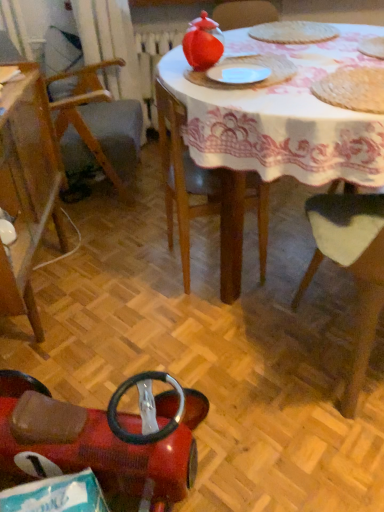
Find the location of a particular element. white lace tablecloth at upper center is located at coordinates click(x=277, y=130).

You are a GUI agent. You are given a task and a screenshot of the screen. Output one action in this format:
    pyautogui.click(x=<x>, y=<y>)
    Task: Click on the rubberized red toy car at lower left, the 2th chair positioned from the right
    The image size is (384, 512).
    Given the screenshot: What is the action you would take?
    pyautogui.click(x=104, y=437)

Image resolution: width=384 pixels, height=512 pixels. What are the coordinates of `white textured placemat at upper center, positioned as the 1th food in top-to-bottom order` in the screenshot? It's located at (293, 32).

Measure the distance between matte glass tea pot at upper center and camera.

matte glass tea pot at upper center and camera are 4.33 feet apart from each other.

What is the approximate width of woven mat at upper right, which is the 1th food from front to back?

woven mat at upper right, which is the 1th food from front to back, is 14.72 inches in width.

This screenshot has height=512, width=384. Find the location of `wooden chair at left, the first chair when ordered from left to right`. wooden chair at left, the first chair when ordered from left to right is located at coordinates (27, 189).

This screenshot has width=384, height=512. I want to click on white lace tablecloth at upper center, so click(277, 130).

Considering the relative sizes of white lace tablecloth at upper center and woven mat at upper right, which is the second food in top-to-bottom order, in the image provided, is white lace tablecloth at upper center wider than woven mat at upper right, which is the second food in top-to-bottom order,?

Correct, the width of white lace tablecloth at upper center exceeds that of woven mat at upper right, which is the second food in top-to-bottom order.

Which object is positioned more to the left, white lace tablecloth at upper center or woven mat at upper right, which is the 1th food from front to back?

Positioned to the left is white lace tablecloth at upper center.

Locate an element on the screen. The image size is (384, 512). table in front of the woven mat at upper right, the first food when ordered from bottom to top is located at coordinates (277, 130).

Does white lace tablecloth at upper center turn towards woven mat at upper right, placed as the 2th food when sorted from back to front?

No, white lace tablecloth at upper center is not oriented towards woven mat at upper right, placed as the 2th food when sorted from back to front.

Is white lace tablecloth at upper center completely or partially inside white textured placemat at upper center, which is the 2th food from front to back?

That's incorrect, white lace tablecloth at upper center is not inside white textured placemat at upper center, which is the 2th food from front to back.

From a real-world perspective, does white textured placemat at upper center, which is the 2th food from front to back, sit lower than white lace tablecloth at upper center?

No.

At what (x,y) coordinates should I click in order to perform the action: click on the 2nd food behind the white lace tablecloth at upper center. Please return your answer as a coordinate pair (x, y). Image resolution: width=384 pixels, height=512 pixels. Looking at the image, I should click on click(293, 32).

From a real-world perspective, is white matte paper plate at center located beneath wooden chair at left, acting as the third chair starting from the right?

No, from a real-world perspective, white matte paper plate at center is not below wooden chair at left, acting as the third chair starting from the right.

From the image's perspective, who appears lower, white matte paper plate at center or wooden chair at left, acting as the third chair starting from the right?

wooden chair at left, acting as the third chair starting from the right, appears lower in the image.

Is white matte paper plate at center positioned before wooden chair at left, acting as the third chair starting from the right?

No, the depth of white matte paper plate at center is greater than that of wooden chair at left, acting as the third chair starting from the right.

Choose the correct answer: Is rubberized red toy car at lower left, the 2th chair positioned from the right, inside white textured placemat at upper center, positioned as the 1th food in top-to-bottom order, or outside it?

rubberized red toy car at lower left, the 2th chair positioned from the right, lies outside white textured placemat at upper center, positioned as the 1th food in top-to-bottom order.

Between rubberized red toy car at lower left, the 2th chair positioned from the right, and white textured placemat at upper center, positioned as the 1th food in top-to-bottom order, which one has less height?

white textured placemat at upper center, positioned as the 1th food in top-to-bottom order, is shorter.

From a real-world perspective, between rubberized red toy car at lower left, the second chair viewed from the left, and white textured placemat at upper center, placed as the 2th food when sorted from bottom to top, who is vertically higher?

From a 3D spatial view, white textured placemat at upper center, placed as the 2th food when sorted from bottom to top, is above.

Considering the points (182, 466) and (299, 32), which point is behind, point (182, 466) or point (299, 32)?

Positioned behind is point (299, 32).

Is matte glass tea pot at upper center to the left of white lace tablecloth at upper center from the viewer's perspective?

Correct, you'll find matte glass tea pot at upper center to the left of white lace tablecloth at upper center.

Considering the relative sizes of matte glass tea pot at upper center and white lace tablecloth at upper center in the image provided, is matte glass tea pot at upper center smaller than white lace tablecloth at upper center?

Yes, matte glass tea pot at upper center is smaller than white lace tablecloth at upper center.

Considering their positions, is matte glass tea pot at upper center located in front of or behind white lace tablecloth at upper center?

Visually, matte glass tea pot at upper center is located behind white lace tablecloth at upper center.

Where is `table on the right of matte glass tea pot at upper center`? This screenshot has height=512, width=384. table on the right of matte glass tea pot at upper center is located at coordinates (277, 130).

Locate an element on the screen. chair on the right side of rubberized red toy car at lower left, the second chair viewed from the left is located at coordinates (351, 266).

Does wooden chair at lower right, the 1th chair positioned from the right, have a larger size compared to rubberized red toy car at lower left, the 2th chair positioned from the right?

Yes, wooden chair at lower right, the 1th chair positioned from the right, is bigger than rubberized red toy car at lower left, the 2th chair positioned from the right.

Is wooden chair at lower right, the 1th chair positioned from the right, at the right side of rubberized red toy car at lower left, the second chair viewed from the left?

Yes, wooden chair at lower right, the 1th chair positioned from the right, is to the right of rubberized red toy car at lower left, the second chair viewed from the left.

Would you say wooden chair at lower right, the 1th chair positioned from the right, contains rubberized red toy car at lower left, the 2th chair positioned from the right?

No, wooden chair at lower right, the 1th chair positioned from the right, does not contain rubberized red toy car at lower left, the 2th chair positioned from the right.

Considering the positions of objects white lace tablecloth at upper center and white matte paper plate at center in the image provided, who is behind, white lace tablecloth at upper center or white matte paper plate at center?

white matte paper plate at center is behind.

Is white lace tablecloth at upper center far from white matte paper plate at center?

That's not correct — white lace tablecloth at upper center is a little close to white matte paper plate at center.

In terms of width, does white lace tablecloth at upper center look wider or thinner when compared to white matte paper plate at center?

In the image, white lace tablecloth at upper center appears to be wider than white matte paper plate at center.

Which of these two, white lace tablecloth at upper center or white matte paper plate at center, is bigger?

With larger size is white lace tablecloth at upper center.

The width and height of the screenshot is (384, 512). Identify the location of table beneath the woven mat at upper right, placed as the 2th food when sorted from back to front (from a real-world perspective). (277, 130).

From a real-world perspective, which food is the 2nd one above the white lace tablecloth at upper center? Please provide its 2D coordinates.

[(293, 32)]

Estimate the real-world distances between objects in this image. Which object is further from wooden chair at left, the first chair when ordered from left to right, white matte paper plate at center or wooden chair at lower right, the 1th chair positioned from the right?

The object further to wooden chair at left, the first chair when ordered from left to right, is wooden chair at lower right, the 1th chair positioned from the right.

From the picture: When comparing their distances from rubberized red toy car at lower left, the second chair viewed from the left, does white textured placemat at upper center, the first food when ordered from back to front, or woven mat at upper right, the first food when ordered from bottom to top, seem further?

white textured placemat at upper center, the first food when ordered from back to front, is positioned further to the anchor rubberized red toy car at lower left, the second chair viewed from the left.

When comparing their distances from white textured placemat at upper center, the first food when ordered from back to front, does wooden chair at left, the first chair when ordered from left to right, or rubberized red toy car at lower left, the second chair viewed from the left, seem further?

Among the two, rubberized red toy car at lower left, the second chair viewed from the left, is located further to white textured placemat at upper center, the first food when ordered from back to front.

Considering their positions, is wooden chair at left, the first chair when ordered from left to right, positioned closer to white textured placemat at upper center, placed as the 2th food when sorted from bottom to top, than white lace tablecloth at upper center?

Based on the image, white lace tablecloth at upper center appears to be nearer to white textured placemat at upper center, placed as the 2th food when sorted from bottom to top.

From the image, which object appears to be nearer to white matte paper plate at center, woven mat at upper right, which is the 1th food from front to back, or rubberized red toy car at lower left, the 2th chair positioned from the right?

Based on the image, woven mat at upper right, which is the 1th food from front to back, appears to be nearer to white matte paper plate at center.

When comparing their distances from white textured placemat at upper center, the first food when ordered from back to front, does white matte paper plate at center or white lace tablecloth at upper center seem further?

white matte paper plate at center.

From the image, which object appears to be nearer to white textured placemat at upper center, placed as the 2th food when sorted from bottom to top, white matte paper plate at center or matte glass tea pot at upper center?

matte glass tea pot at upper center is positioned closer to the anchor white textured placemat at upper center, placed as the 2th food when sorted from bottom to top.

When comparing their distances from white textured placemat at upper center, positioned as the 1th food in top-to-bottom order, does matte glass tea pot at upper center or rubberized red toy car at lower left, the second chair viewed from the left, seem further?

Among the two, rubberized red toy car at lower left, the second chair viewed from the left, is located further to white textured placemat at upper center, positioned as the 1th food in top-to-bottom order.

You are a GUI agent. You are given a task and a screenshot of the screen. Output one action in this format:
    pyautogui.click(x=<x>, y=<y>)
    Task: Click on the table between white textured placemat at upper center, the first food when ordered from back to front, and wooden chair at lower right, the 1th chair positioned from the right, from top to bottom
    This screenshot has width=384, height=512.
    Given the screenshot: What is the action you would take?
    pyautogui.click(x=277, y=130)

Locate an element on the screen. This screenshot has width=384, height=512. tea pot between wooden chair at left, the first chair when ordered from left to right, and white lace tablecloth at upper center is located at coordinates (203, 42).

Locate an element on the screen. This screenshot has height=512, width=384. paper plate between wooden chair at left, the first chair when ordered from left to right, and woven mat at upper right, which is the 1th food from front to back, in the horizontal direction is located at coordinates (238, 73).

This screenshot has width=384, height=512. In order to click on food positioned between white lace tablecloth at upper center and white textured placemat at upper center, positioned as the 1th food in top-to-bottom order, from near to far in this screenshot , I will do `click(353, 89)`.